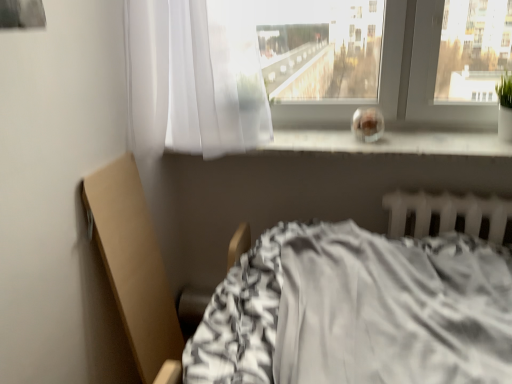
You are a GUI agent. You are given a task and a screenshot of the screen. Output one action in this format:
    pyautogui.click(x=<x>, y=<y>)
    Task: Click on the gray fabric bed at lower center
    The width and height of the screenshot is (512, 384).
    Given the screenshot: What is the action you would take?
    pyautogui.click(x=446, y=212)

What do you see at coordinates (194, 78) in the screenshot? I see `sheer white curtain at upper center` at bounding box center [194, 78].

What do you see at coordinates (391, 143) in the screenshot? The height and width of the screenshot is (384, 512). I see `transparent glass at center` at bounding box center [391, 143].

You are a GUI agent. You are given a task and a screenshot of the screen. Output one action in this format:
    pyautogui.click(x=<x>, y=<y>)
    Task: Click on the gray fabric bed at lower center
    
    Given the screenshot: What is the action you would take?
    pyautogui.click(x=446, y=212)

How many degrees apart are the facing directions of sheer white curtain at upper center and gray fabric bed at lower center?

0.163 degrees.

Which is more to the right, sheer white curtain at upper center or gray fabric bed at lower center?

gray fabric bed at lower center.

Is sheer white curtain at upper center in front of or behind gray fabric bed at lower center in the image?

In the image, sheer white curtain at upper center appears behind gray fabric bed at lower center.

Is sheer white curtain at upper center beside gray fabric bed at lower center?

No, sheer white curtain at upper center is not with gray fabric bed at lower center.

Between transparent glass at center and sheer white curtain at upper center, which one appears on the right side from the viewer's perspective?

transparent glass at center.

Does point (379, 153) come in front of point (138, 86)?

That is False.

Looking at this image, can you confirm if transparent glass at center is wider than sheer white curtain at upper center?

Incorrect, the width of transparent glass at center does not surpass that of sheer white curtain at upper center.

Where is `window sill that appears below the sheer white curtain at upper center (from a real-world perspective)`? window sill that appears below the sheer white curtain at upper center (from a real-world perspective) is located at coordinates (391, 143).

How different are the orientations of transparent glass at center and white plastic radiator at lower right in degrees?

The angular difference between transparent glass at center and white plastic radiator at lower right is 1.25 degrees.

Where is `window sill in front of the white plastic radiator at lower right`? The image size is (512, 384). window sill in front of the white plastic radiator at lower right is located at coordinates (391, 143).

In the scene shown: Considering the sizes of objects transparent glass at center and white plastic radiator at lower right in the image provided, who is thinner, transparent glass at center or white plastic radiator at lower right?

With smaller width is white plastic radiator at lower right.

Which is behind, transparent glass at center or white plastic radiator at lower right?

white plastic radiator at lower right.

Is point (511, 202) closer to camera compared to point (176, 59)?

That is True.

From the image's perspective, would you say white plastic radiator at lower right is positioned over sheer white curtain at upper center?

No, from the image's perspective, white plastic radiator at lower right is not above sheer white curtain at upper center.

Is white plastic radiator at lower right positioned far away from sheer white curtain at upper center?

white plastic radiator at lower right is actually quite close to sheer white curtain at upper center.

Consider the image. Are white plastic radiator at lower right and gray fabric bed at lower center located far from each other?

They are positioned close to each other.

This screenshot has height=384, width=512. Identify the location of radiator lying on the right of gray fabric bed at lower center. (447, 213).

Is gray fabric bed at lower center completely or partially inside white plastic radiator at lower right?

Actually, gray fabric bed at lower center is outside white plastic radiator at lower right.

Based on their sizes in the image, would you say white plastic radiator at lower right is bigger or smaller than gray fabric bed at lower center?

In the image, white plastic radiator at lower right appears to be smaller than gray fabric bed at lower center.

From a real-world perspective, which is physically above, gray fabric bed at lower center or white plastic radiator at lower right?

white plastic radiator at lower right.

Which is in front, point (494, 221) or point (470, 234)?

The point (494, 221) is more forward.

What's the angular difference between gray fabric bed at lower center and white plastic radiator at lower right's facing directions?

gray fabric bed at lower center and white plastic radiator at lower right are facing 0.435 degrees away from each other.

Looking at this image, is gray fabric bed at lower center not close to white plastic radiator at lower right?

No.

Can you tell me how much gray fabric bed at lower center and transparent glass at center differ in facing direction?

The angle between the facing direction of gray fabric bed at lower center and the facing direction of transparent glass at center is 0.818 degrees.

Can transparent glass at center be found inside gray fabric bed at lower center?

That's incorrect, transparent glass at center is not inside gray fabric bed at lower center.

Is gray fabric bed at lower center oriented away from transparent glass at center?

That's not correct — gray fabric bed at lower center is not looking away from transparent glass at center.

Looking at this image, does gray fabric bed at lower center come in front of transparent glass at center?

Yes, gray fabric bed at lower center is closer to the camera.

You are a GUI agent. You are given a task and a screenshot of the screen. Output one action in this format:
    pyautogui.click(x=<x>, y=<y>)
    Task: Click on the bed that is under the sheer white curtain at upper center (from a real-world perspective)
    The image size is (512, 384).
    Given the screenshot: What is the action you would take?
    pyautogui.click(x=446, y=212)

At what (x,y) coordinates should I click in order to perform the action: click on curtain above the transparent glass at center (from the image's perspective). Please return your answer as a coordinate pair (x, y). Image resolution: width=512 pixels, height=384 pixels. Looking at the image, I should click on (194, 78).

Based on their spatial positions, is white plastic radiator at lower right or transparent glass at center further from gray fabric bed at lower center?

transparent glass at center is positioned further to the anchor gray fabric bed at lower center.

When comparing their distances from sheer white curtain at upper center, does transparent glass at center or gray fabric bed at lower center seem further?

Based on the image, gray fabric bed at lower center appears to be further to sheer white curtain at upper center.

From the image, which object appears to be nearer to transparent glass at center, white plastic radiator at lower right or sheer white curtain at upper center?

white plastic radiator at lower right lies closer to transparent glass at center than the other object.

Based on their spatial positions, is sheer white curtain at upper center or transparent glass at center further from white plastic radiator at lower right?

Among the two, sheer white curtain at upper center is located further to white plastic radiator at lower right.

Estimate the real-world distances between objects in this image. Which object is further from gray fabric bed at lower center, transparent glass at center or white plastic radiator at lower right?

transparent glass at center is further to gray fabric bed at lower center.

Which object lies nearer to the anchor point transparent glass at center, gray fabric bed at lower center or sheer white curtain at upper center?

Based on the image, gray fabric bed at lower center appears to be nearer to transparent glass at center.

Considering their positions, is transparent glass at center positioned closer to gray fabric bed at lower center than sheer white curtain at upper center?

Based on the image, transparent glass at center appears to be nearer to gray fabric bed at lower center.

Estimate the real-world distances between objects in this image. Which object is closer to white plastic radiator at lower right, gray fabric bed at lower center or sheer white curtain at upper center?

Based on the image, gray fabric bed at lower center appears to be nearer to white plastic radiator at lower right.

You are a GUI agent. You are given a task and a screenshot of the screen. Output one action in this format:
    pyautogui.click(x=<x>, y=<y>)
    Task: Click on the window sill between gray fabric bed at lower center and white plastic radiator at lower right in the front-back direction
    The image size is (512, 384).
    Given the screenshot: What is the action you would take?
    pyautogui.click(x=391, y=143)

Locate an element on the screen. The height and width of the screenshot is (384, 512). window sill between sheer white curtain at upper center and gray fabric bed at lower center in the vertical direction is located at coordinates (391, 143).

Image resolution: width=512 pixels, height=384 pixels. In order to click on window sill located between sheer white curtain at upper center and white plastic radiator at lower right in the left-right direction in this screenshot , I will do `click(391, 143)`.

This screenshot has width=512, height=384. Find the location of `radiator between sheer white curtain at upper center and gray fabric bed at lower center from top to bottom`. radiator between sheer white curtain at upper center and gray fabric bed at lower center from top to bottom is located at coordinates (447, 213).